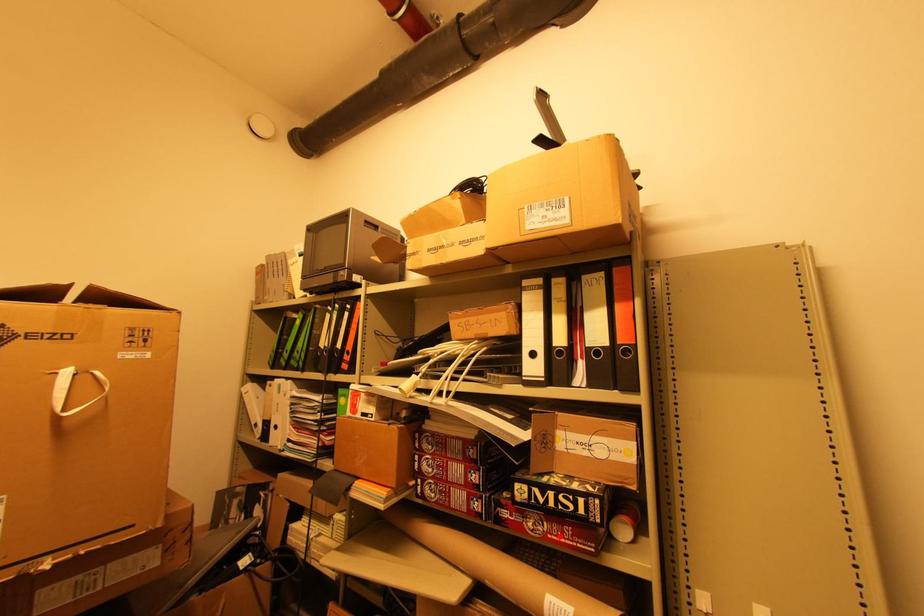
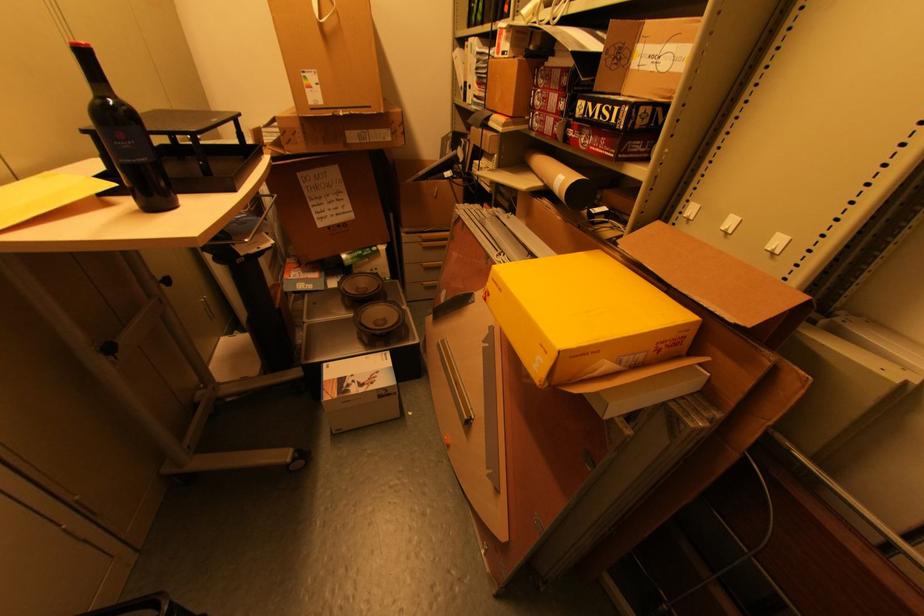
Find the pixel in the second image that matches the highlighted location in the first image.

(599, 148)